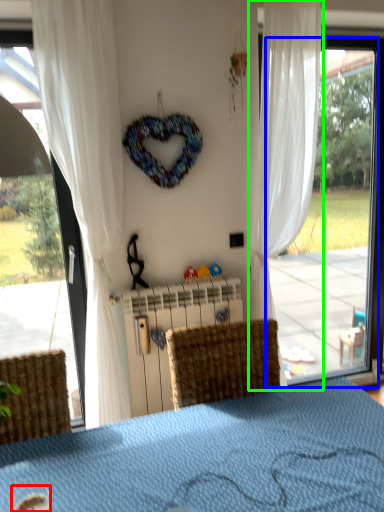
Question: Which object is the farthest from beverage (highlighted by a red box)? Choose among these: window (highlighted by a blue box) or curtain (highlighted by a green box).

Choices:
 (A) window
 (B) curtain

Answer: (B)